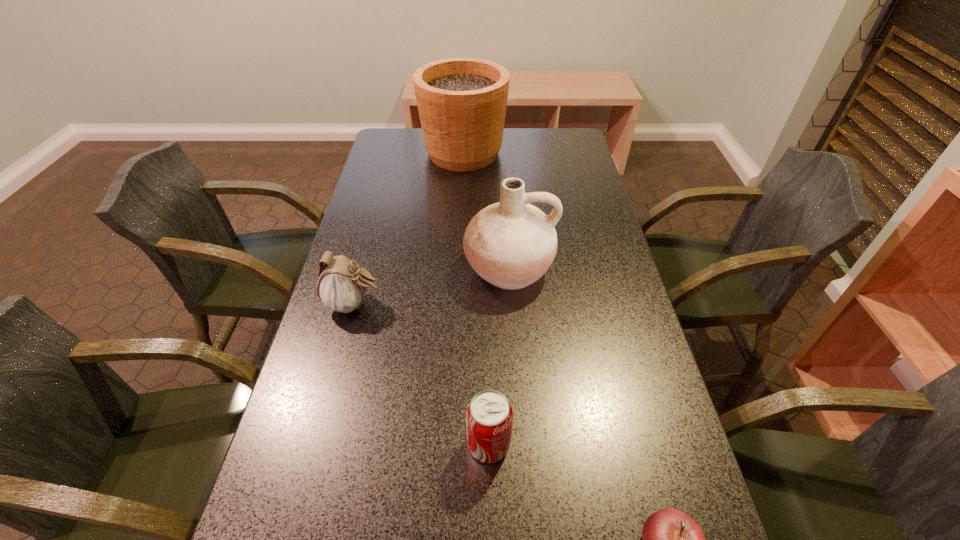
The height and width of the screenshot is (540, 960). Identify the location of free space between the soda and the farthest object. (476, 299).

Identify which object is the fourth nearest to the farthest object. Please provide its 2D coordinates. Your answer should be formatted as a tuple, i.e. [(x, y)], where the tuple contains the x and y coordinates of a point satisfying the conditions above.

[(671, 539)]

This screenshot has width=960, height=540. I want to click on object that is the third closest to the pottery, so 462,102.

This screenshot has height=540, width=960. In order to click on blank area in the image that satisfies the following two spatial constraints: 1. on the front-facing side of the leftmost object; 2. on the right side of the soda in this screenshot , I will do `click(317, 444)`.